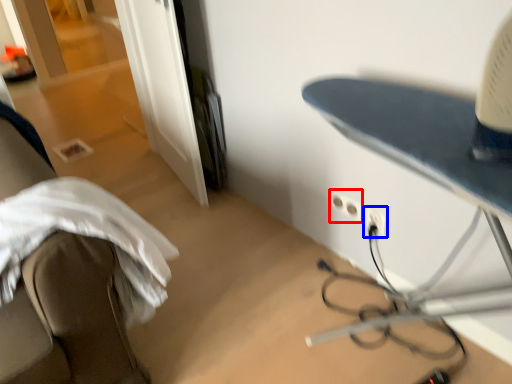
Question: Which object is further to the camera taking this photo, electric outlet (highlighted by a red box) or electric outlet (highlighted by a blue box)?

Choices:
 (A) electric outlet
 (B) electric outlet

Answer: (A)